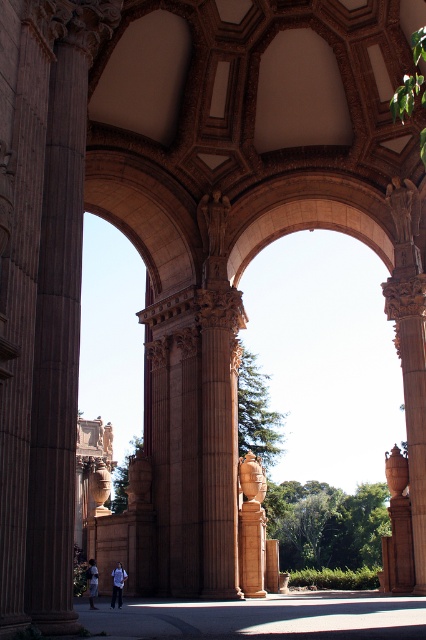
Between brown stone vase at right and white cotton shirt at lower center, which one is positioned lower?

white cotton shirt at lower center is below.

From the picture: Does brown stone vase at right have a greater width compared to white cotton shirt at lower center?

Incorrect, brown stone vase at right's width does not surpass white cotton shirt at lower center's.

This screenshot has width=426, height=640. Describe the element at coordinates (397, 528) in the screenshot. I see `brown stone vase at right` at that location.

Locate an element on the screen. Image resolution: width=426 pixels, height=640 pixels. brown stone vase at right is located at coordinates (397, 528).

Does point (394, 508) come in front of point (94, 563)?

Yes, it is.

Between brown stone vase at right and denim pants at lower left, which one appears on the left side from the viewer's perspective?

denim pants at lower left is more to the left.

You are a GUI agent. You are given a task and a screenshot of the screen. Output one action in this format:
    pyautogui.click(x=<x>, y=<y>)
    Task: Click on the brown stone vase at right
    The width and height of the screenshot is (426, 640).
    Given the screenshot: What is the action you would take?
    pyautogui.click(x=397, y=528)

Can you confirm if smooth tan stone column at center is positioned below brown stone vase at right?

Correct, smooth tan stone column at center is located below brown stone vase at right.

Where is `smooth tan stone column at center`? This screenshot has height=640, width=426. smooth tan stone column at center is located at coordinates (252, 525).

Does point (253, 570) come in front of point (405, 484)?

That is False.

Where is `smooth tan stone column at center`? Image resolution: width=426 pixels, height=640 pixels. smooth tan stone column at center is located at coordinates (252, 525).